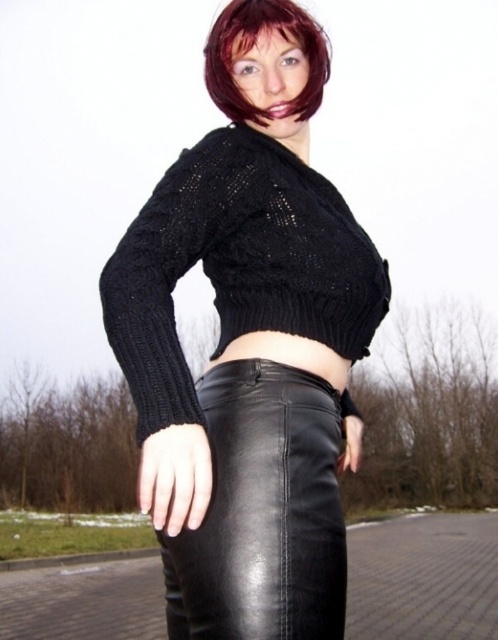
You are a fashion designer observing the outfit of the person in the image. You need to determine if the black leather skirt at lower center will cover the dark red hair at upper center when the person sits down. Based on the height difference between them, what is your conclusion?

The black leather skirt at lower center is taller than the dark red hair at upper center, so when the person sits down, the skirt will likely cover the hair since it extends higher up the body.